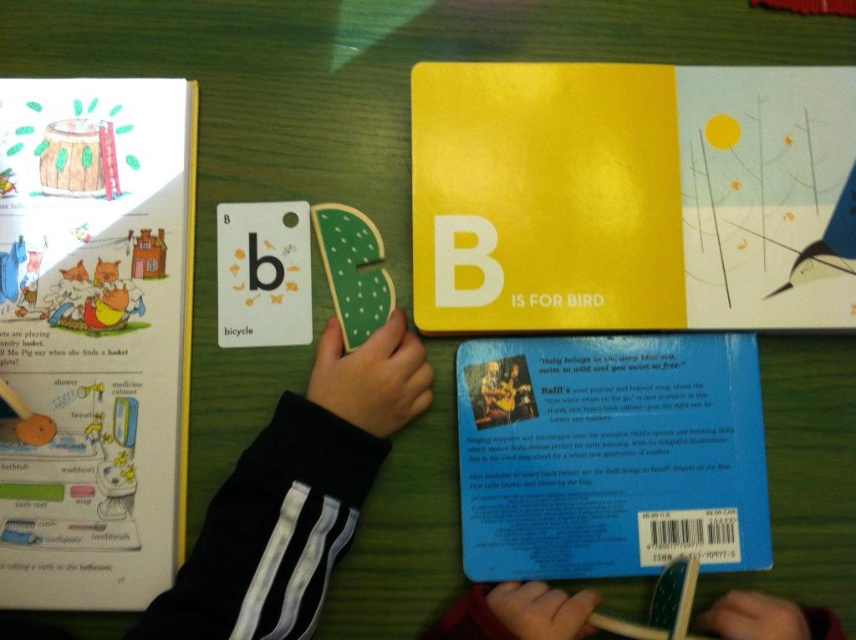
Between matte paper book at left and blue matte book at center, which one appears on the right side from the viewer's perspective?

blue matte book at center

Can you confirm if matte paper book at left is positioned to the left of blue matte book at center?

Indeed, matte paper book at left is positioned on the left side of blue matte book at center.

Is point (75, 314) positioned behind point (742, 358)?

No.

Where is `matte paper book at left`? matte paper book at left is located at coordinates (94, 337).

Is blue matte book at center wider than black fabric hand at center?

In fact, blue matte book at center might be narrower than black fabric hand at center.

Is point (504, 401) farther from camera compared to point (535, 589)?

Yes, it is.

This screenshot has height=640, width=856. In order to click on blue matte book at center in this screenshot , I will do `click(610, 456)`.

Who is higher up, yellow matte book at upper center or blue matte book at center?

yellow matte book at upper center is higher up.

Based on the photo, who is more forward, (789, 116) or (617, 540)?

Point (617, 540) is more forward.

Between point (409, 116) and point (500, 531), which one is positioned in front?

Point (500, 531)

Image resolution: width=856 pixels, height=640 pixels. In order to click on yellow matte book at upper center in this screenshot , I will do point(631,196).